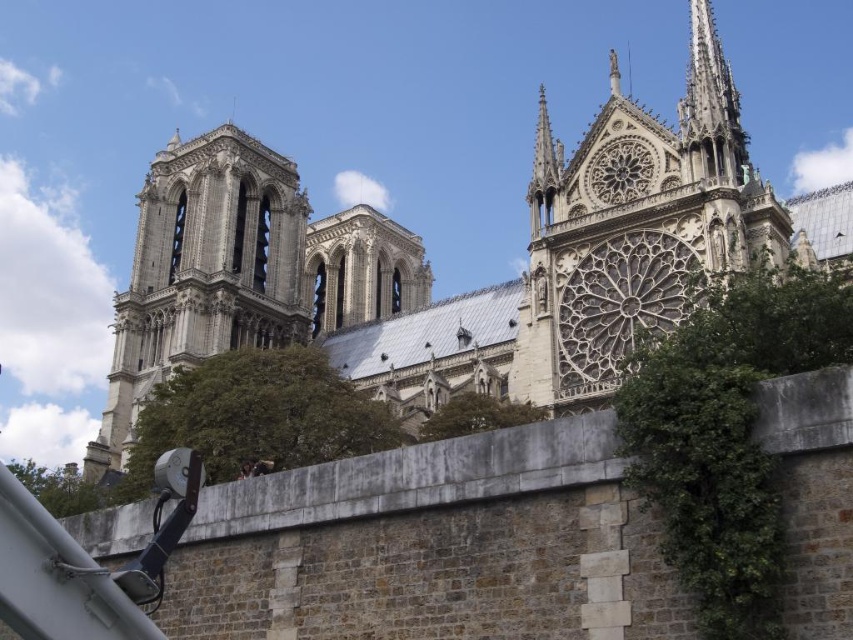
Question: Estimate the real-world distances between objects in this image. Which object is farther from the smooth stone spire at upper right?

Choices:
 (A) white stone church at center
 (B) white stone rose window at upper right

Answer: (A)

Question: Which point appears closest to the camera in this image?

Choices:
 (A) (718, 161)
 (B) (694, 35)
 (C) (389, 298)

Answer: (A)

Question: Which is nearer to the smooth stone spire at upper right?

Choices:
 (A) white stone rose window at upper right
 (B) white stone church at center

Answer: (A)

Question: Can you confirm if white stone rose window at upper right is positioned to the left of smooth stone spire at upper right?

Choices:
 (A) no
 (B) yes

Answer: (B)

Question: Is white stone rose window at upper right wider than smooth stone spire at upper right?

Choices:
 (A) yes
 (B) no

Answer: (B)

Question: Is the position of white stone rose window at upper right less distant than that of smooth stone spire at upper right?

Choices:
 (A) no
 (B) yes

Answer: (B)